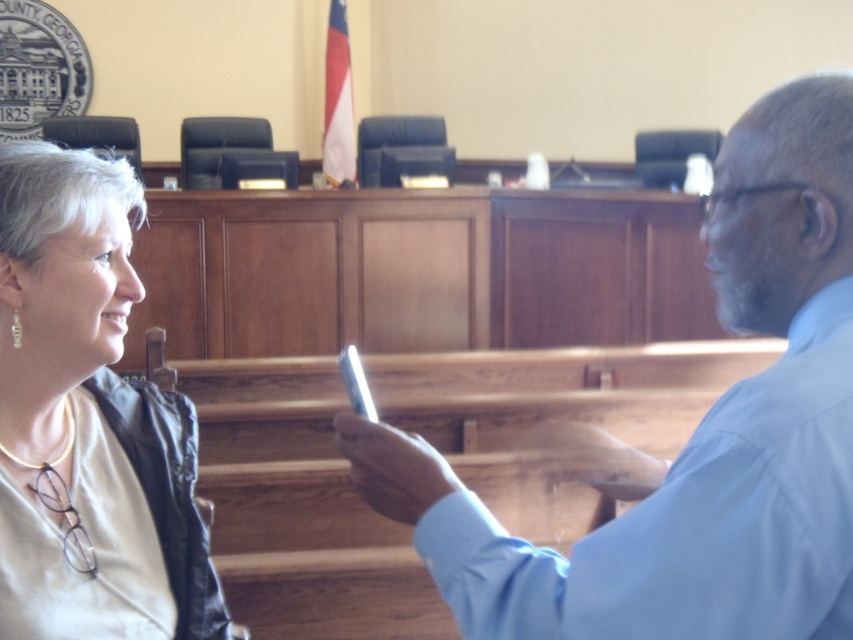
You are a photographer taking a picture of the courtroom scene. You notice two points marked in the image at coordinates point (828, 628) and point (62, 150). Which point should you focus on to ensure the foreground subject is in sharp focus?

Point (828, 628) should be focused on because it is closer to the camera than point (62, 150), ensuring the foreground subject is in sharp focus.

You are an observer in the courtroom scene. You notice the light blue shirt at center and the matte black jacket at left. Which object is shorter in height?

The light blue shirt at center has a lesser height compared to the matte black jacket at left, so the light blue shirt at center is shorter in height.